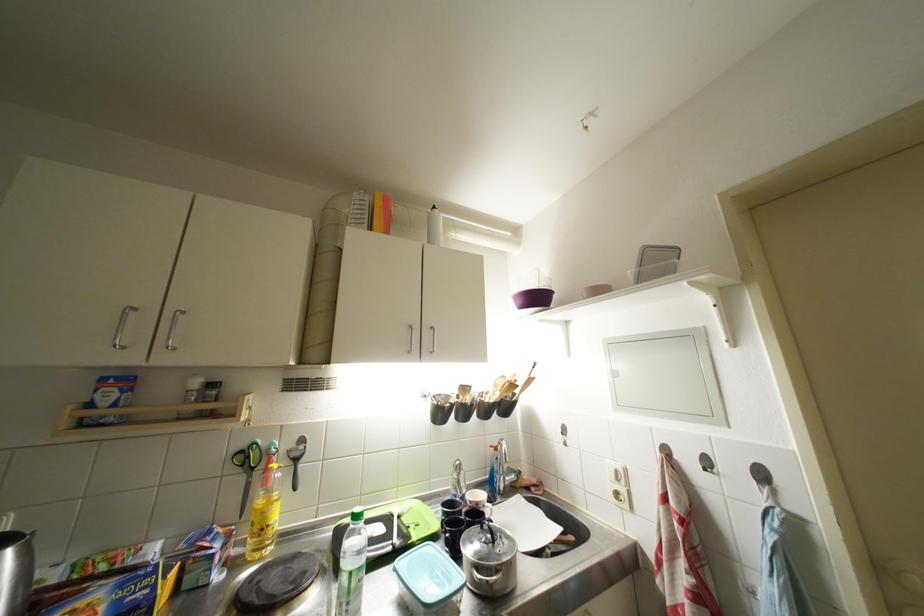
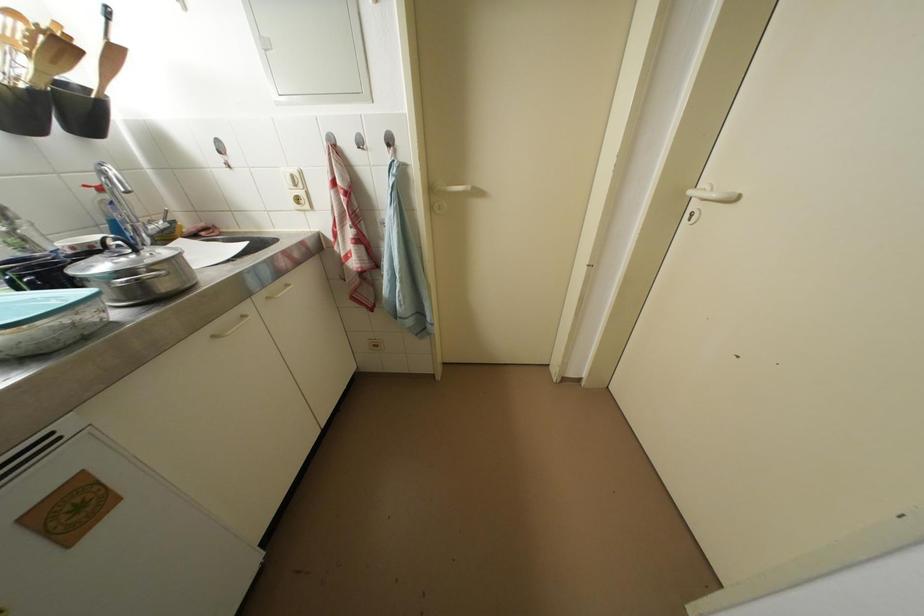
Where in the second image is the point corresponding to (537,384) from the first image?

(120, 55)